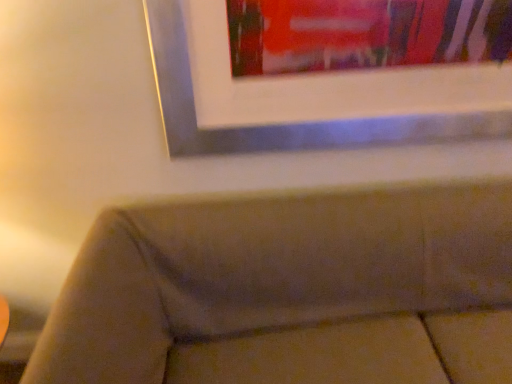
Question: Is velvet beige couch at lower center further to the viewer compared to metallic silver picture frame at upper center?

Choices:
 (A) no
 (B) yes

Answer: (A)

Question: Is velvet beige couch at lower center not close to metallic silver picture frame at upper center?

Choices:
 (A) no
 (B) yes

Answer: (A)

Question: Considering the relative sizes of velvet beige couch at lower center and metallic silver picture frame at upper center in the image provided, is velvet beige couch at lower center shorter than metallic silver picture frame at upper center?

Choices:
 (A) yes
 (B) no

Answer: (B)

Question: Is velvet beige couch at lower center bigger than metallic silver picture frame at upper center?

Choices:
 (A) yes
 (B) no

Answer: (A)

Question: Does velvet beige couch at lower center have a greater height compared to metallic silver picture frame at upper center?

Choices:
 (A) no
 (B) yes

Answer: (B)

Question: Is velvet beige couch at lower center facing away from metallic silver picture frame at upper center?

Choices:
 (A) no
 (B) yes

Answer: (A)

Question: From a real-world perspective, is metallic silver picture frame at upper center on velvet beige couch at lower center?

Choices:
 (A) no
 (B) yes

Answer: (B)

Question: Can you confirm if metallic silver picture frame at upper center is shorter than velvet beige couch at lower center?

Choices:
 (A) yes
 (B) no

Answer: (A)

Question: Is metallic silver picture frame at upper center oriented towards velvet beige couch at lower center?

Choices:
 (A) yes
 (B) no

Answer: (B)

Question: Can you confirm if metallic silver picture frame at upper center is positioned to the left of velvet beige couch at lower center?

Choices:
 (A) no
 (B) yes

Answer: (B)

Question: Can you confirm if metallic silver picture frame at upper center is thinner than velvet beige couch at lower center?

Choices:
 (A) no
 (B) yes

Answer: (B)

Question: Does metallic silver picture frame at upper center appear on the right side of velvet beige couch at lower center?

Choices:
 (A) no
 (B) yes

Answer: (A)

Question: In terms of width, does velvet beige couch at lower center look wider or thinner when compared to metallic silver picture frame at upper center?

Choices:
 (A) wide
 (B) thin

Answer: (A)